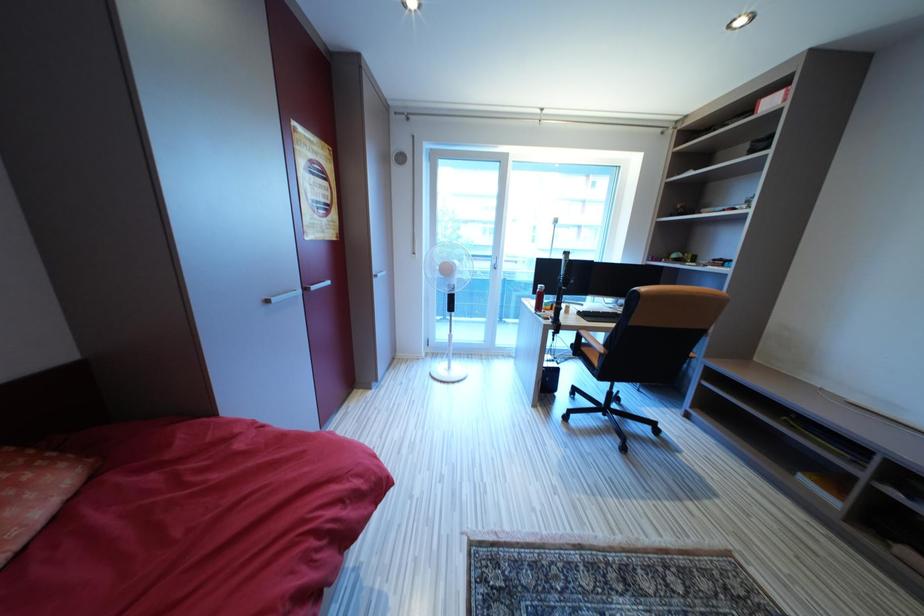
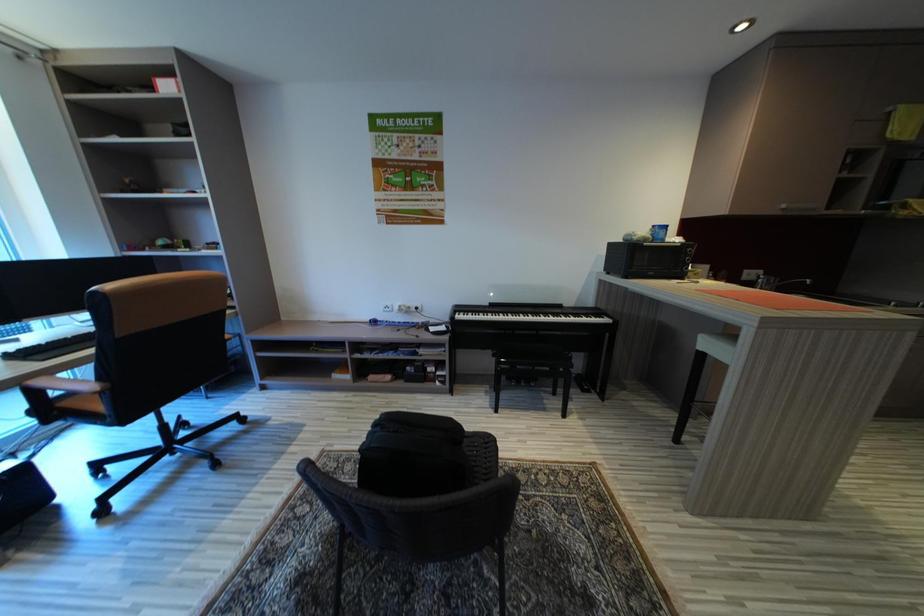
Based on the continuous images, in which direction is the camera rotating?

The camera's rotation is toward right-down.